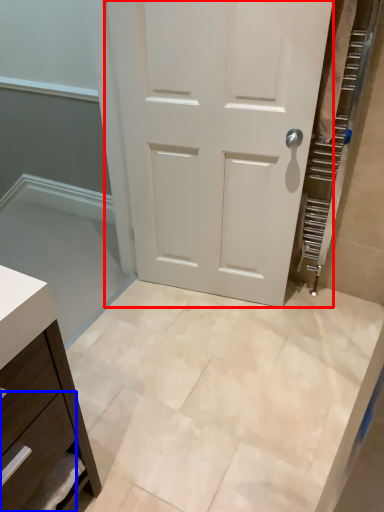
Question: Among these objects, which one is farthest to the camera, door (highlighted by a red box) or drawer (highlighted by a blue box)?

Choices:
 (A) door
 (B) drawer

Answer: (A)